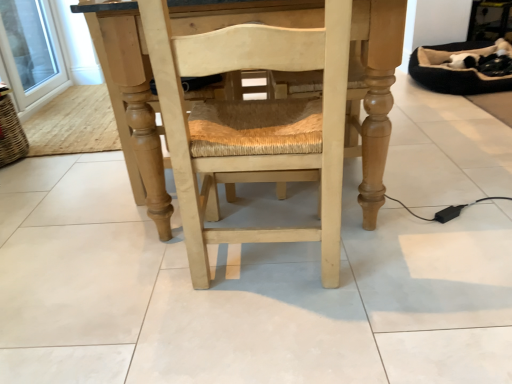
What are the coordinates of `free spot to the right of light wood chair at center` in the screenshot? It's located at (411, 259).